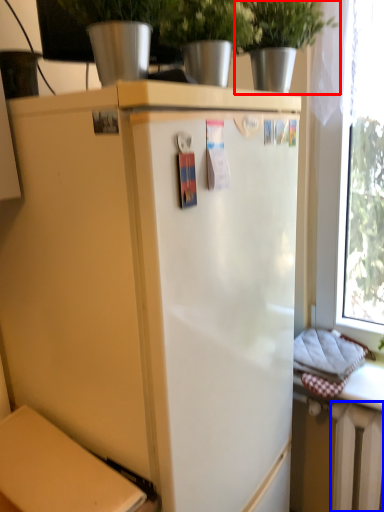
Question: Which object appears farthest to the camera in this image, houseplant (highlighted by a red box) or radiator (highlighted by a blue box)?

Choices:
 (A) houseplant
 (B) radiator

Answer: (B)